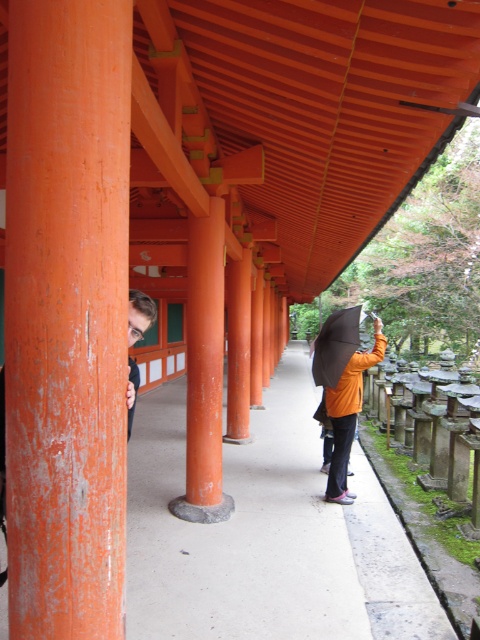
You are a delivery person carrying a package that is 2.5 meters long. You need to pass through the area between the smooth concrete path at center and the black matte umbrella at center. Can you fit through the space between them?

The smooth concrete path at center and black matte umbrella at center are 2.43 meters apart from each other. Since the package is 2.5 meters long, it is slightly longer than the available space. Therefore, the package cannot fit through the space between them.

You are standing at the center of the pathway under the traditional Japanese structure. You want to see the person on the left who is partially hidden behind the smooth orange wood pillar at left. In which direction should you move to get a better view of them?

To get a better view of the person on the left hidden behind the smooth orange wood pillar at left, you should move to the right. This will allow you to see around the pillar.

You are standing at the entrance of the Japanese structure and want to walk straight ahead to reach the center of the scene. According to the coordinates provided, where should you aim to step on the smooth concrete path at center?

You should aim to step at the coordinates point (267, 536) on the smooth concrete path at center as it is located at that position.